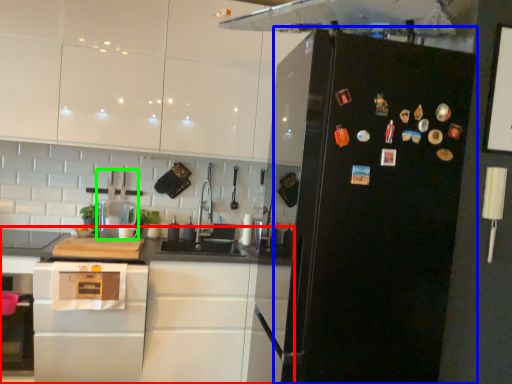
Question: Which is nearer to the cabinetry (highlighted by a red box)? refrigerator (highlighted by a blue box) or kitchen appliance (highlighted by a green box).

Choices:
 (A) refrigerator
 (B) kitchen appliance

Answer: (B)